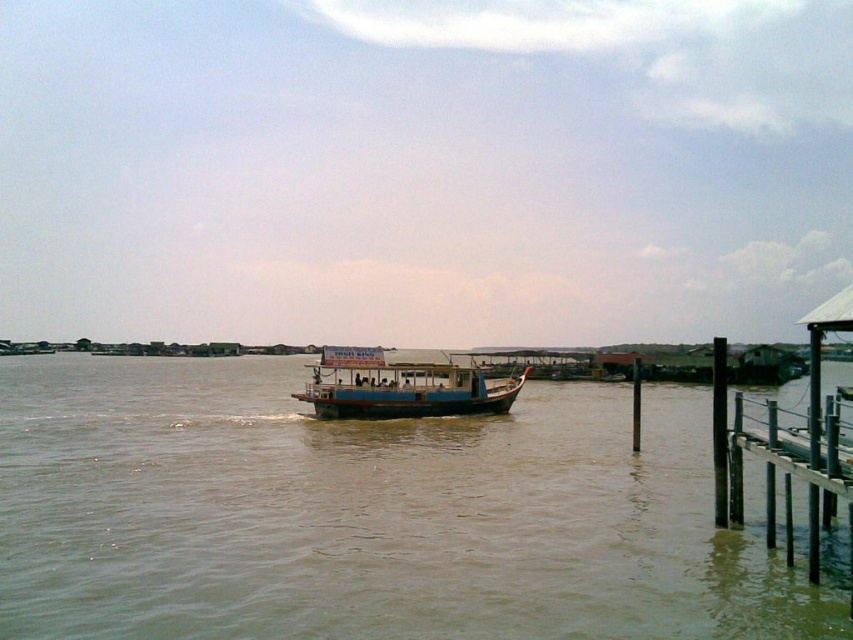
You are standing on the black metal dock at lower right and want to reach the boat in the scene. The boat is currently 32.59 feet away from you. If your maximum walking distance is 30 feet, can you reach the boat without getting wet?

The boat is 32.59 feet away from the black metal dock at lower right, which exceeds your maximum walking distance of 30 feet. Therefore, you cannot reach the boat without getting wet.

You are a boat operator who needs to navigate a new route. You see the brown muddy water at center and the black metal dock at lower right. Which one has a greater width?

The brown muddy water at center has a greater width than the black metal dock at lower right.

Consider the image. You are standing on the black metal dock at lower right and want to walk towards the brown muddy water at center. In which direction should you move?

You should move to the left because the brown muddy water at center is to the left of the black metal dock at lower right.